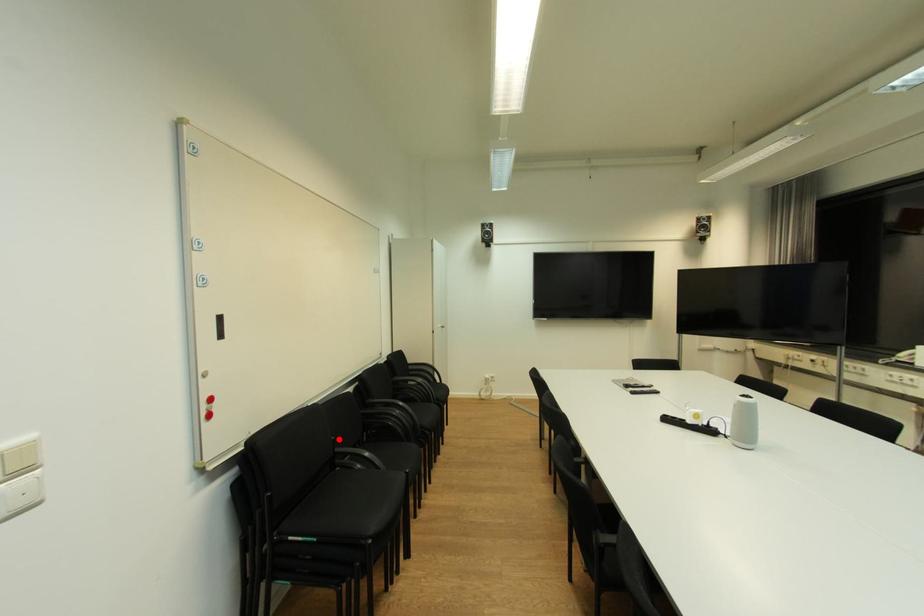
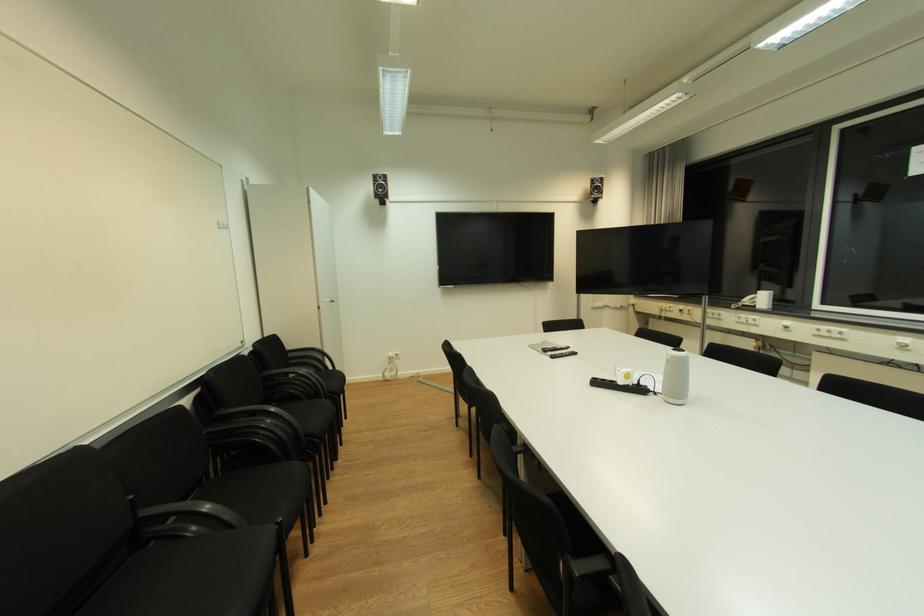
Where in the second image is the point corresponding to the highlighted location from the first image?

(137, 498)